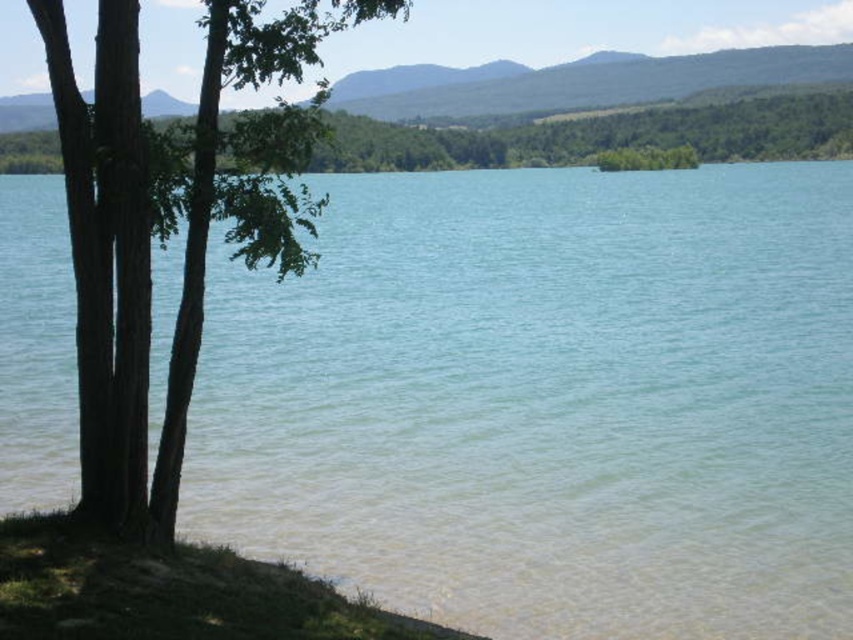
Does clear water at center have a larger size compared to brown rough bark tree at left?

Indeed, clear water at center has a larger size compared to brown rough bark tree at left.

Identify the location of clear water at center. (548, 401).

Can you confirm if clear water at center is positioned above green leafy tree at upper left?

Actually, clear water at center is below green leafy tree at upper left.

Does clear water at center have a larger size compared to green leafy tree at upper left?

Actually, clear water at center might be smaller than green leafy tree at upper left.

Is point (370, 198) closer to camera compared to point (366, 154)?

Yes.

I want to click on clear water at center, so click(548, 401).

Does clear water at center have a smaller size compared to green grass at lower left?

Actually, clear water at center might be larger than green grass at lower left.

Locate an element on the screen. clear water at center is located at coordinates (548, 401).